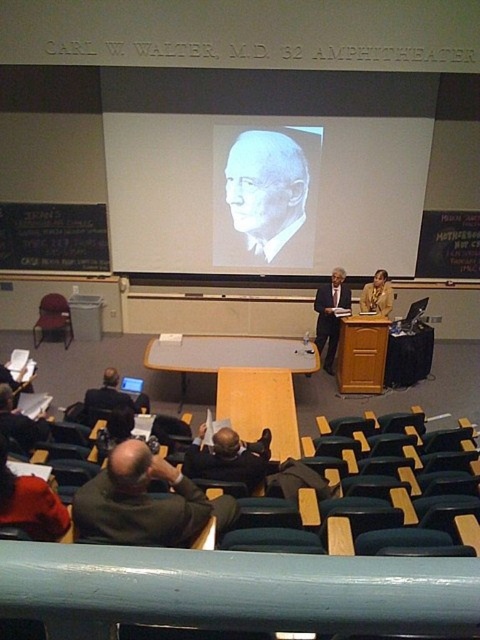
Which is above, dark suit at center or matte plastic chair at left?

Positioned higher is matte plastic chair at left.

Which is behind, point (333, 355) or point (37, 339)?

The point (37, 339) is behind.

In order to click on dark suit at center in this screenshot , I will do `click(331, 314)`.

Does dark green sweater at lower left appear on the right side of dark brown leather jacket at center?

Incorrect, dark green sweater at lower left is not on the right side of dark brown leather jacket at center.

From the picture: Is dark green sweater at lower left further to camera compared to dark brown leather jacket at center?

That is False.

Who is more forward, [147,456] or [194,474]?

Positioned in front is point [147,456].

At what (x,y) coordinates should I click in order to perform the action: click on dark green sweater at lower left. Please return your answer as a coordinate pair (x, y). The image size is (480, 640). Looking at the image, I should click on (144, 502).

Who is more distant from viewer, (180, 504) or (374, 275)?

The point (374, 275) is behind.

Who is higher up, dark green sweater at lower left or matte gold jacket at center?

matte gold jacket at center

Who is more distant from viewer, (105,532) or (374,305)?

Point (374,305)

You are a GUI agent. You are given a task and a screenshot of the screen. Output one action in this format:
    pyautogui.click(x=<x>, y=<y>)
    Task: Click on the dark green sweater at lower left
    The height and width of the screenshot is (640, 480).
    Given the screenshot: What is the action you would take?
    pyautogui.click(x=144, y=502)